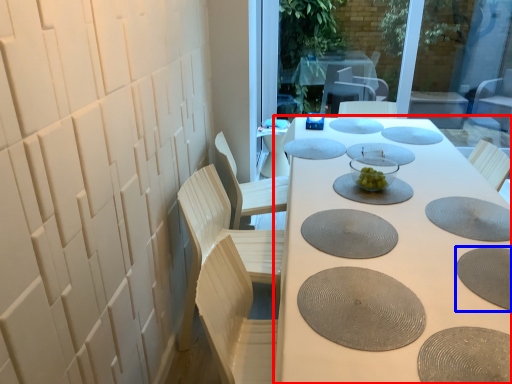
Question: Which object appears closest to the camera in this image, table (highlighted by a red box) or manhole cover (highlighted by a blue box)?

Choices:
 (A) table
 (B) manhole cover

Answer: (A)